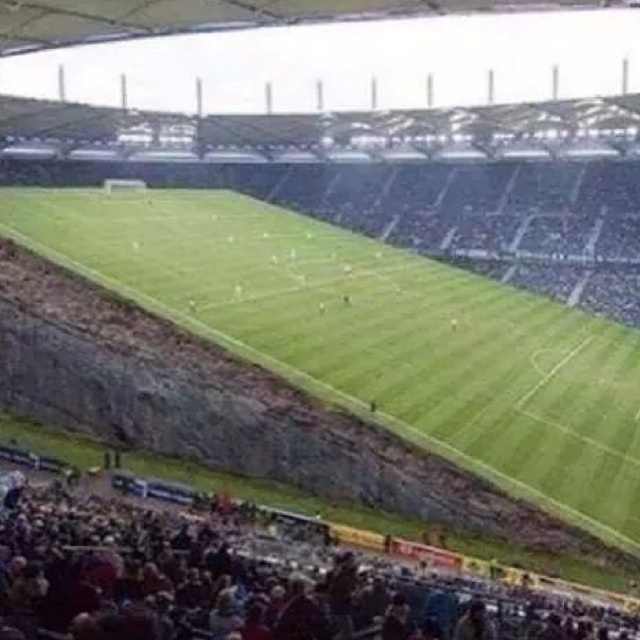
You are a drone operator trying to capture aerial footage of the stadium. You need to ensure that your drone stays above the spectator seating area to avoid any collisions with the football field. Given the coordinates provided, can you confirm if the point marked by point (x=371, y=330) is located within the spectator seating area or the football field?

The point (x=371, y=330) corresponds to the green grass football field at center, so it is located within the football field and not the spectator seating area.

You are a stadium architect reviewing the design. The green grass football field at center and dark brown leather seats at lower left are part of the plan. If the seats are 2 meters wide, what is the minimum width required for the football field to maintain the scale?

The green grass football field at center has a larger size compared to dark brown leather seats at lower left. Since the seats are 2 meters wide, the football field must be wider than 2 meters to maintain the scale.

You are a spectator at the stadium and want to find your seat located at the dark brown leather seats at lower left. From your current position at the green grass football field at center, which direction should you move to reach your seat?

The green grass football field at center is above the dark brown leather seats at lower left, so you should move downward from the green grass football field at center to reach the dark brown leather seats at lower left.